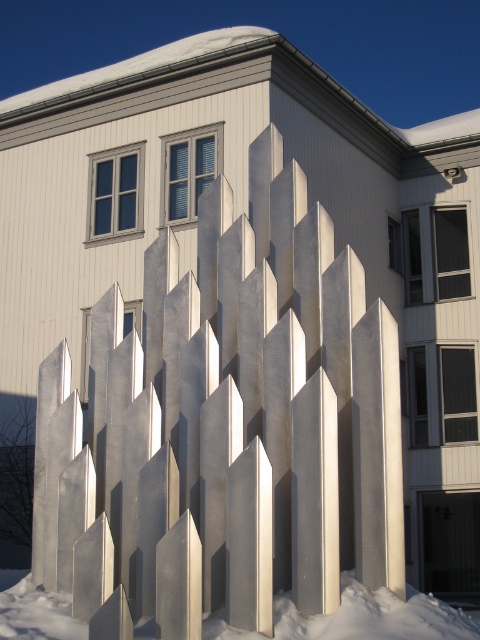
You are standing at the origin point in the image and want to walk towards the metallic silver fence at center. What are the coordinates you need to move to?

The coordinates to move to are approximately 0.669 on the x axis and 0.473 on the y axis, as the metallic silver fence at center is located at point (227, 428).

You are standing in front of the sculpture and want to know where the point at coordinates (227, 428) is located. According to the image, which object does this point belong to?

The point at coordinates (227, 428) is located on the metallic silver fence at center.

You are an architect analyzing the sculpture and its surroundings. Based on the scene, which object takes up more space in the image between the metallic silver fence at center and the white powdery snow at lower center?

The metallic silver fence at center is bigger than white powdery snow at lower center, so it takes up more space in the image.